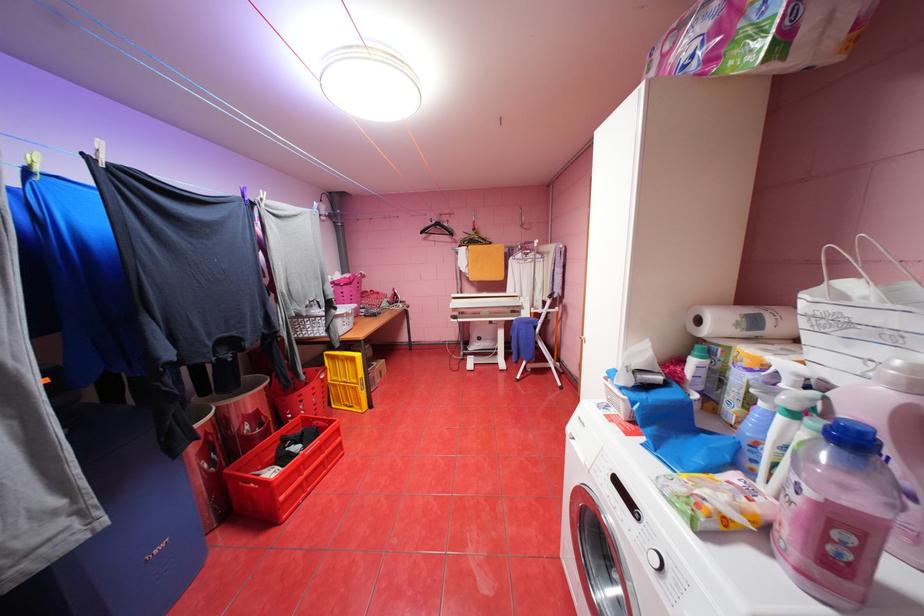
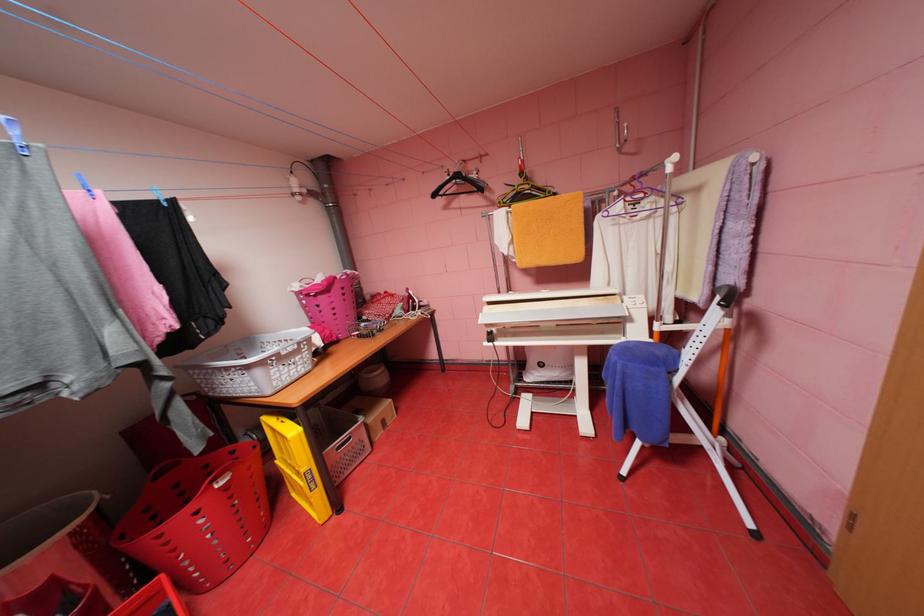
Question: Which direction would the cameraman need to move to produce the second image? Reply with the corresponding letter.

Choices:
 (A) Left
 (B) Right
 (C) Forward
 (D) Backward

Answer: (C)